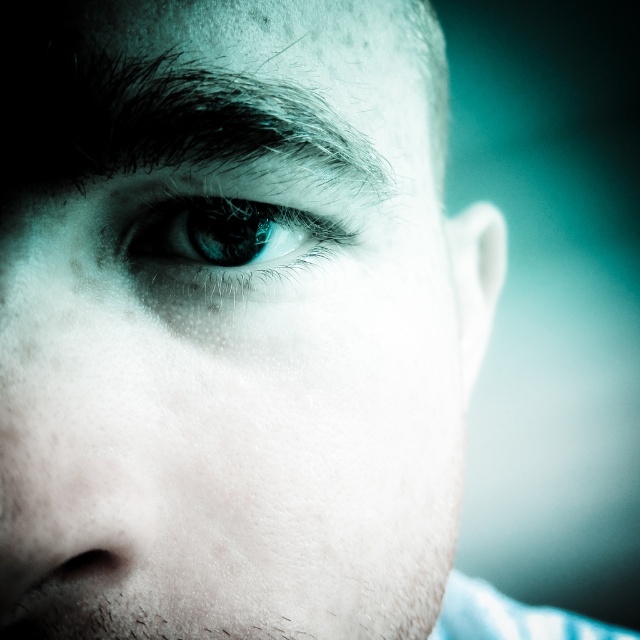
Between smooth skin eye at center and blue glossy eye at center, which one is positioned lower?

smooth skin eye at center

Between smooth skin eye at center and blue glossy eye at center, which one is positioned higher?

Positioned higher is blue glossy eye at center.

You are a GUI agent. You are given a task and a screenshot of the screen. Output one action in this format:
    pyautogui.click(x=<x>, y=<y>)
    Task: Click on the smooth skin eye at center
    The image size is (640, 640).
    Given the screenshot: What is the action you would take?
    pyautogui.click(x=227, y=326)